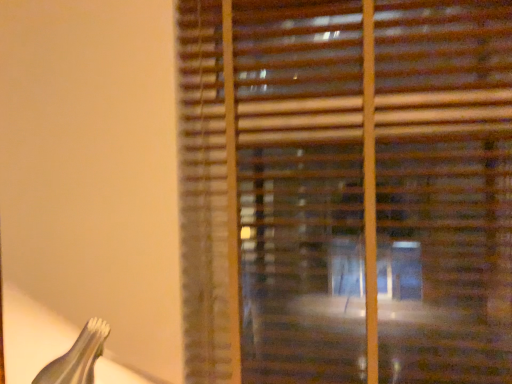
At what (x,y) coordinates should I click in order to perform the action: click on wooden blinds at center. Please return your answer as a coordinate pair (x, y). This screenshot has height=384, width=512. Looking at the image, I should click on (346, 190).

Describe the element at coordinates (346, 190) in the screenshot. Image resolution: width=512 pixels, height=384 pixels. I see `wooden blinds at center` at that location.

What is the approximate width of wooden blinds at center?

→ wooden blinds at center is 3.04 inches in width.

You are a GUI agent. You are given a task and a screenshot of the screen. Output one action in this format:
    pyautogui.click(x=<x>, y=<y>)
    Task: Click on the wooden blinds at center
    The image size is (512, 384).
    Given the screenshot: What is the action you would take?
    pyautogui.click(x=346, y=190)